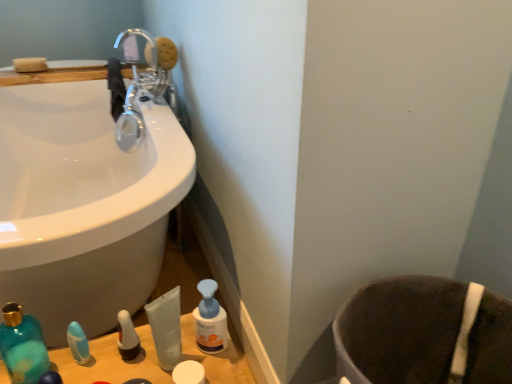
In order to click on free space to the left of blue plastic pump bottle at lower center in this screenshot , I will do `click(138, 352)`.